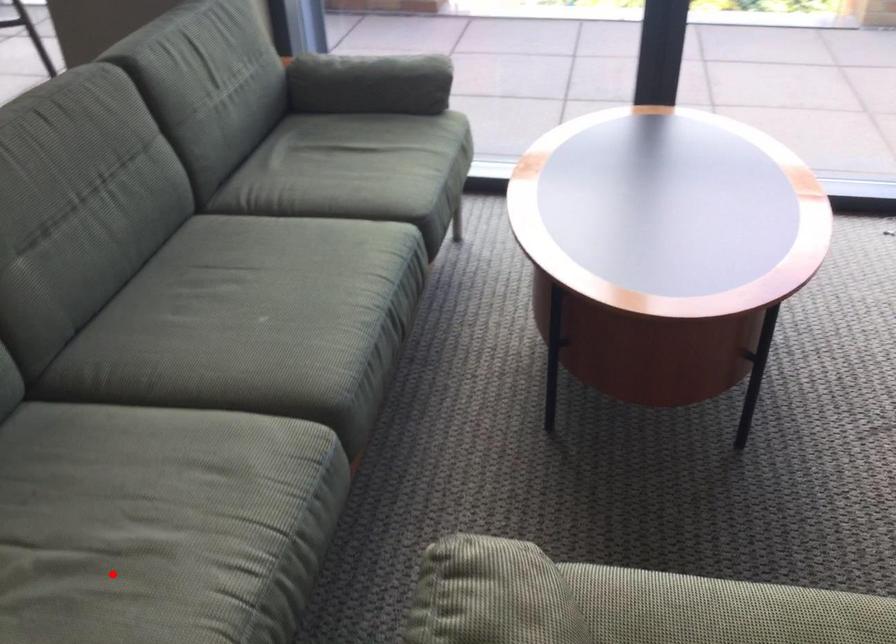
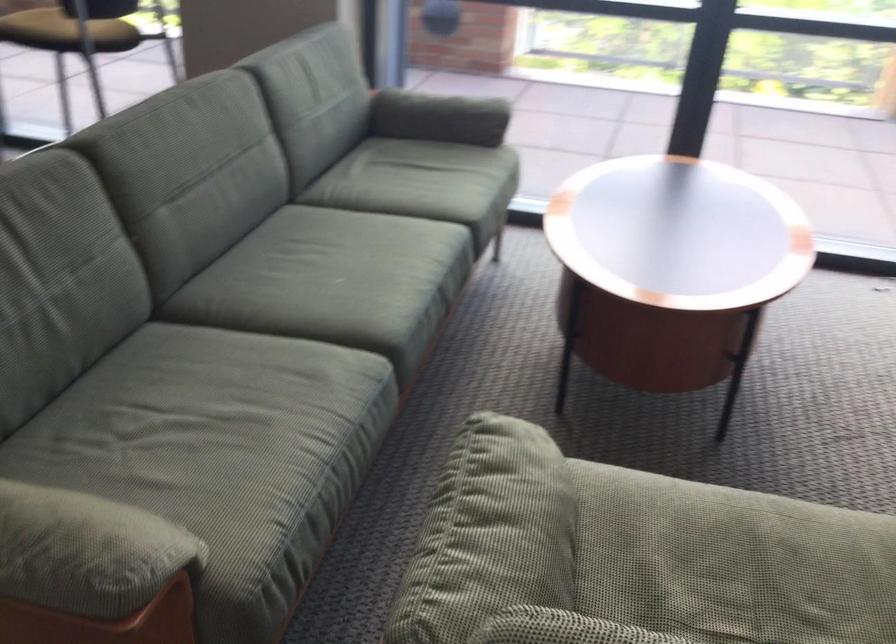
The point at the highlighted location is marked in the first image. Where is the corresponding point in the second image?

(225, 430)